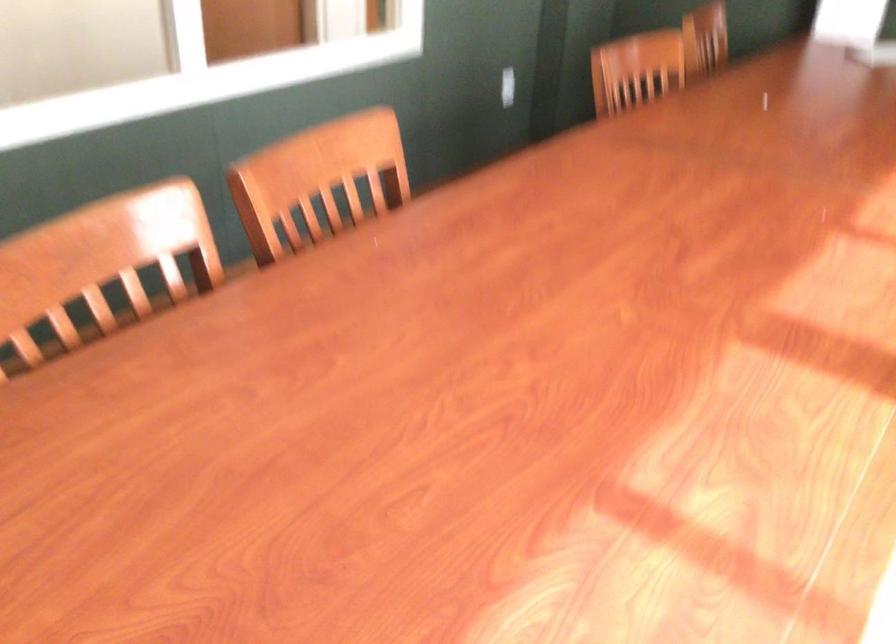
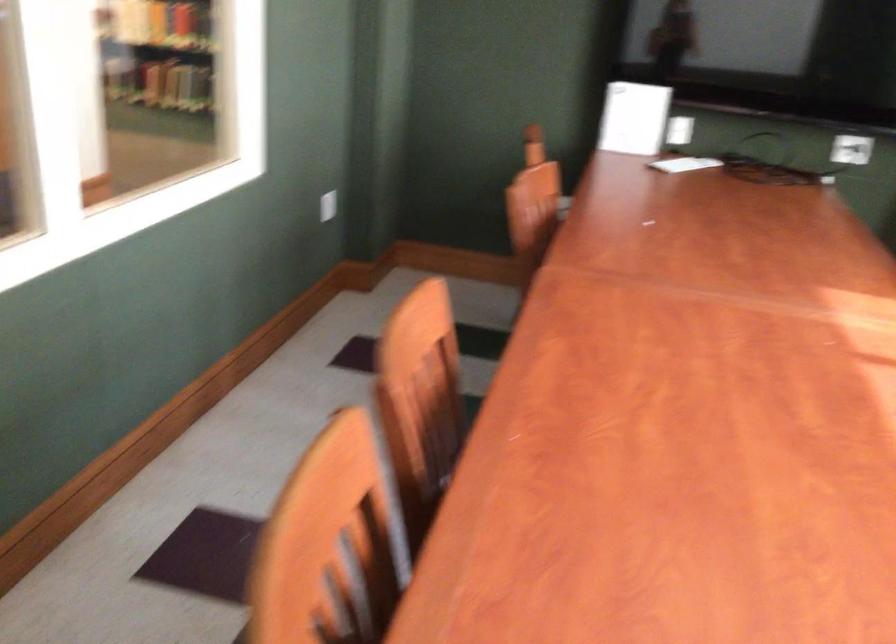
Which direction would the cameraman need to move to produce the second image?

The cameraman walked toward left, forward.